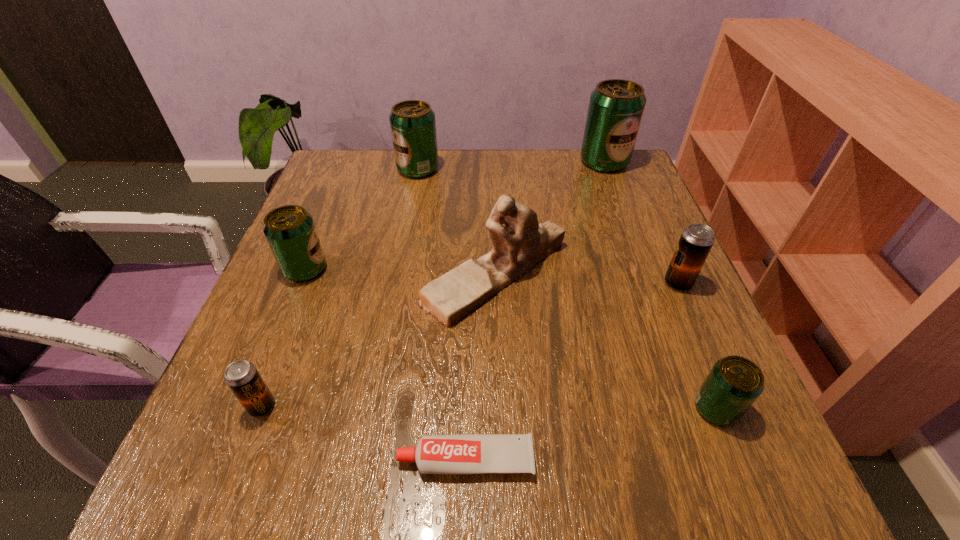
What are the coordinates of `vacant space that satisfies the following two spatial constraints: 1. on the front side of the toothpaste; 2. on the left side of the second green beer can from left to right` in the screenshot? It's located at (364, 459).